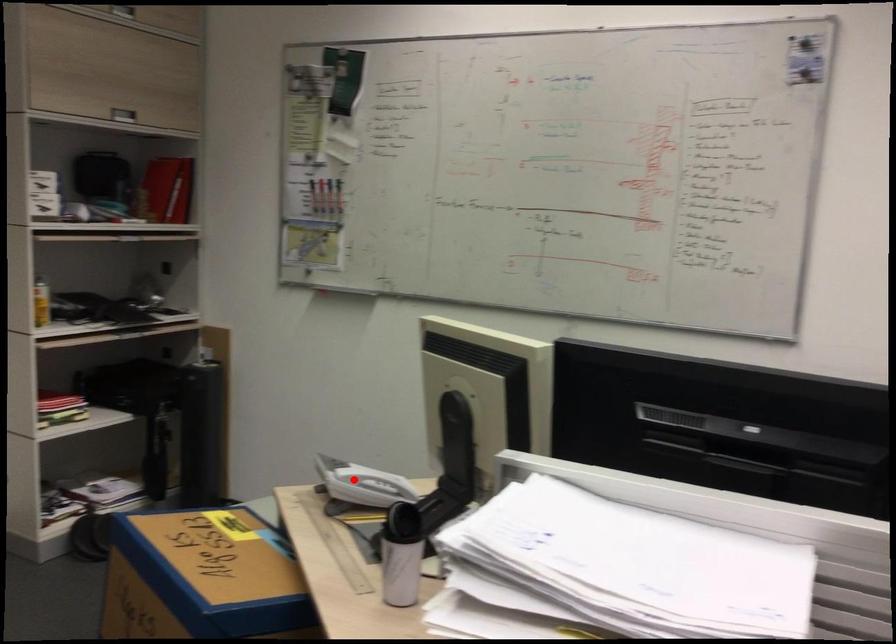
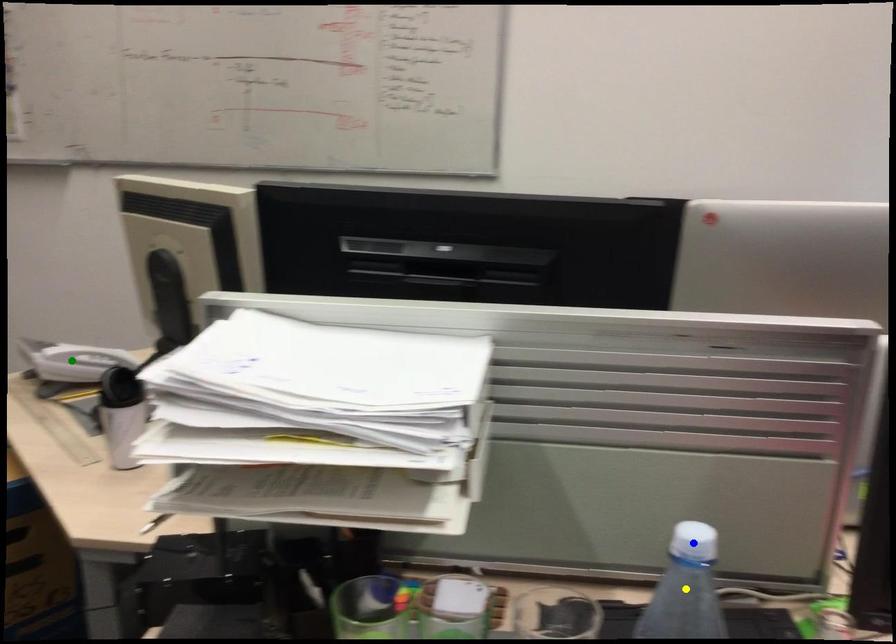
Question: I am providing you with two images of the same scene from different viewpoints. A red point is marked on the first image. You are given multiple points on the second image. Which spot in image 2 lines up with the point in image 1?

Choices:
 (A) blue point
 (B) green point
 (C) yellow point

Answer: (B)